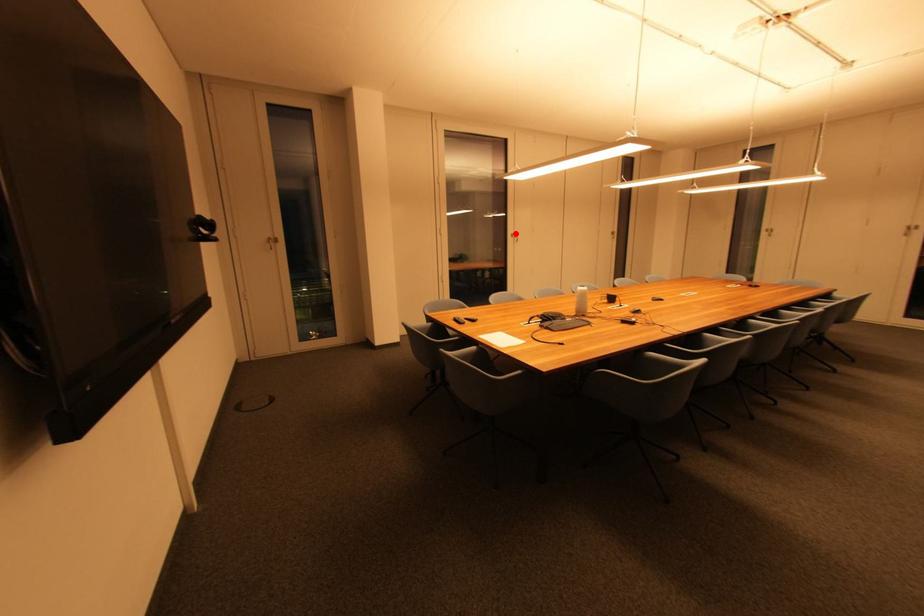
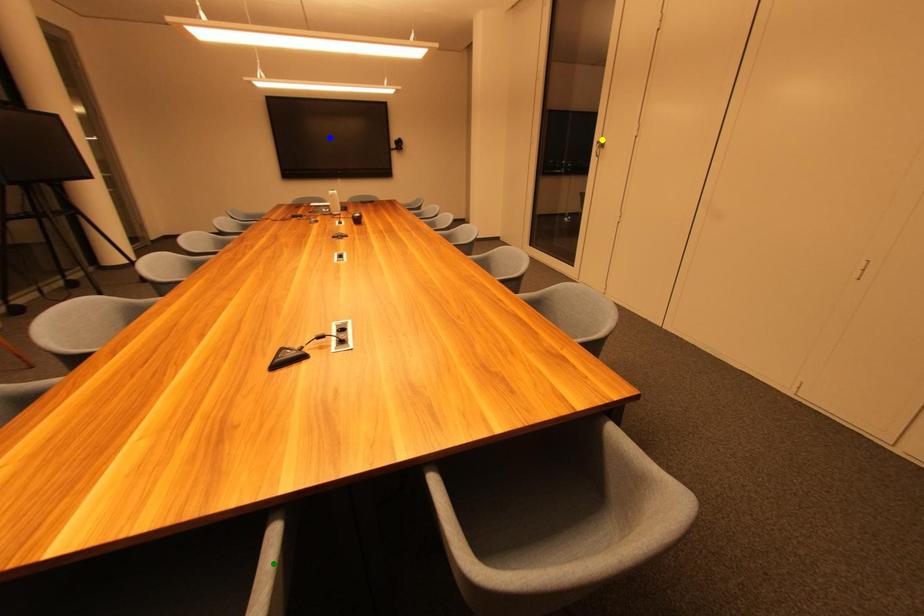
Question: I am providing you with two images of the same scene from different viewpoints. A red point is marked on the first image. You are given multiple points on the second image. Can you choose the point in image 2 that corresponds to the point in image 1?

Choices:
 (A) green point
 (B) blue point
 (C) yellow point

Answer: (C)